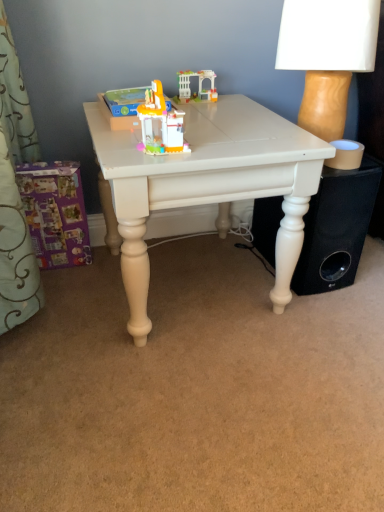
Locate an element on the screen. This screenshot has height=512, width=384. free space between white painted wood table at center and purple cardboard box at lower left, the 3th toy positioned from the front is located at coordinates pos(82,294).